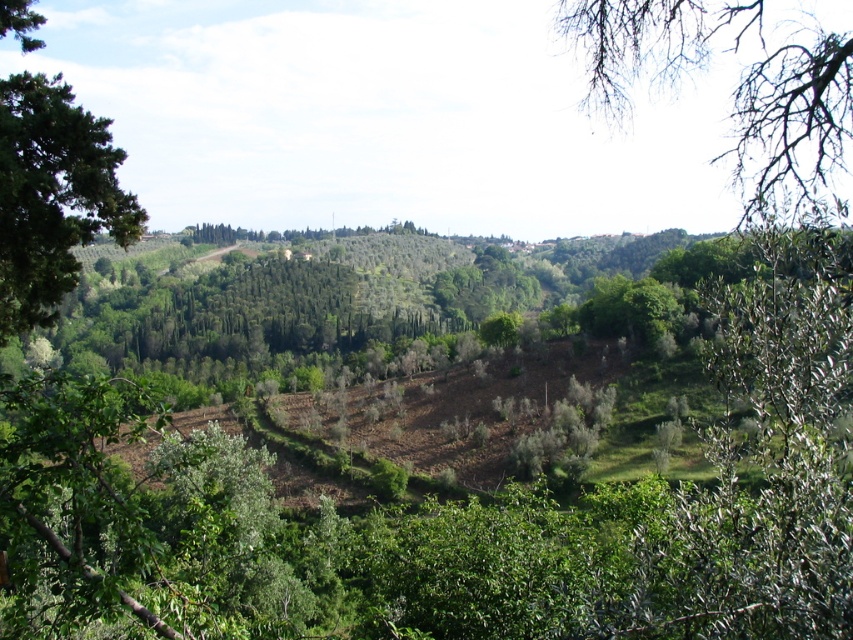
You are a nature photographer trying to capture both the bare branches at upper right and the green leafy tree at left in a single frame. Given their sizes, which tree should you focus on to ensure both are visible without zooming in or out?

Since the bare branches at upper right is larger in size than green leafy tree at left, you should focus on the bare branches at upper right to ensure both are visible without adjusting the zoom.

You are a bird looking for a nesting spot. You see the bare branches at upper right and the green leafy tree at left. Which tree would you choose to build your nest in if you prefer a taller nesting spot?

The bare branches at upper right has a greater height compared to the green leafy tree at left, so the bird would choose the bare branches at upper right to build its nest for a taller nesting spot.